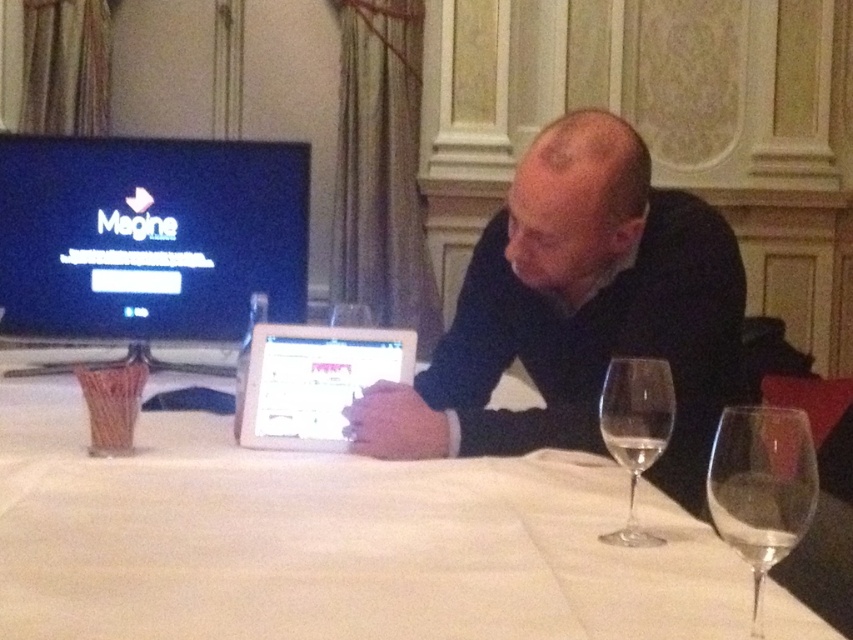
Question: Among these objects, which one is nearest to the camera?

Choices:
 (A) silver metallic tablet at center
 (B) white cloth at center

Answer: (B)

Question: Does silver metallic tablet at center have a greater width compared to clear glass wine glass at center?

Choices:
 (A) yes
 (B) no

Answer: (A)

Question: Among these points, which one is farthest from the camera?

Choices:
 (A) (267, 442)
 (B) (750, 541)

Answer: (A)

Question: Among these points, which one is nearest to the camera?

Choices:
 (A) (247, 403)
 (B) (759, 420)
 (C) (664, 438)
 (D) (593, 195)

Answer: (B)

Question: Is silver metallic tablet at center closer to the viewer compared to clear glass wine glass at right?

Choices:
 (A) yes
 (B) no

Answer: (B)

Question: Can you confirm if white cloth at center is wider than clear glass at lower right?

Choices:
 (A) no
 (B) yes

Answer: (B)